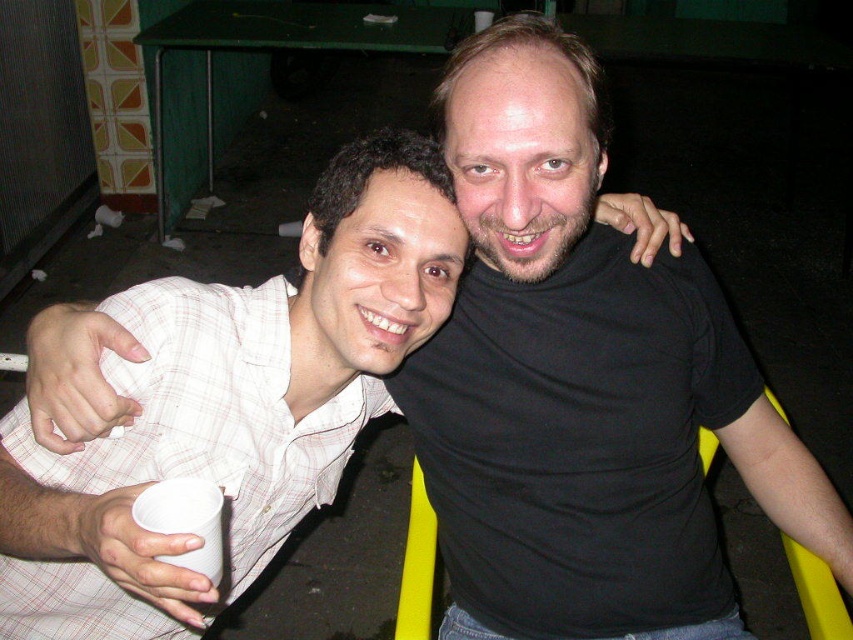
You are a photographer who wants to take a photo of the black matte shirt at upper right and the white checkered shirt at left. Based on their positions, which one is higher in the frame?

The black matte shirt at upper right is higher in the frame than the white checkered shirt at left.

In the scene shown: You are taking a photo of the scene described. To ensure the black matte shirt at upper right is centered in your viewfinder, where should you adjust the camera position relative to the current frame?

The black matte shirt at upper right is located at point (583, 384), so you should move the camera slightly to the left and down to center it in the viewfinder.